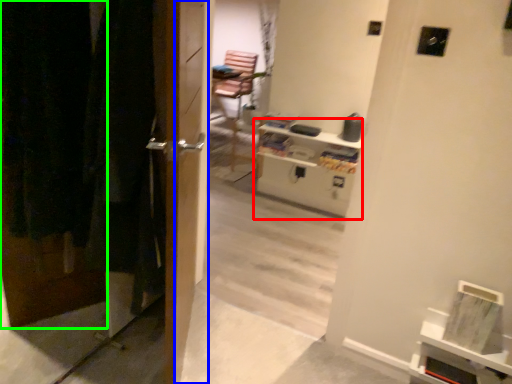
Question: Which object is the farthest from entertainment center (highlighted by a red box)? Choose among these: screen door (highlighted by a blue box) or door (highlighted by a green box).

Choices:
 (A) screen door
 (B) door

Answer: (B)